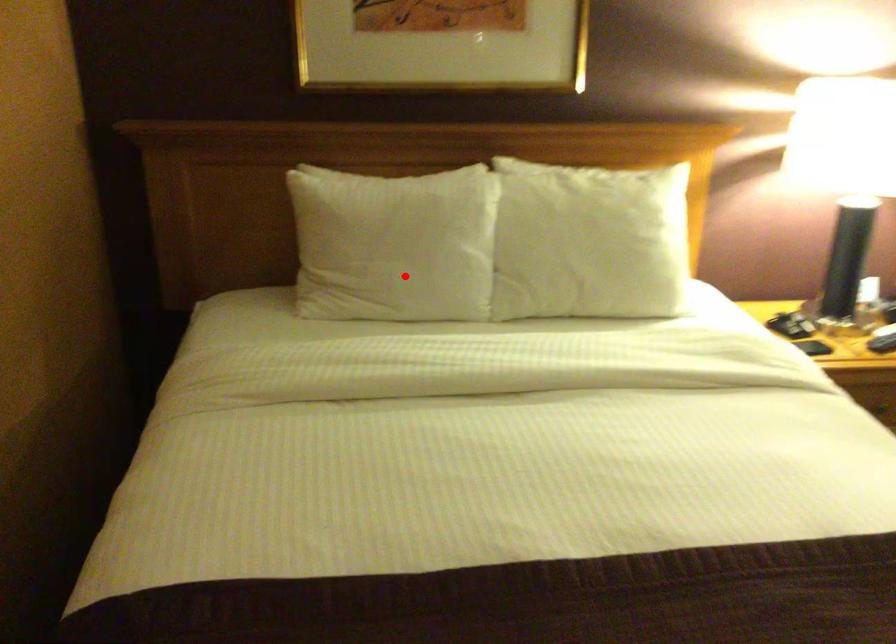
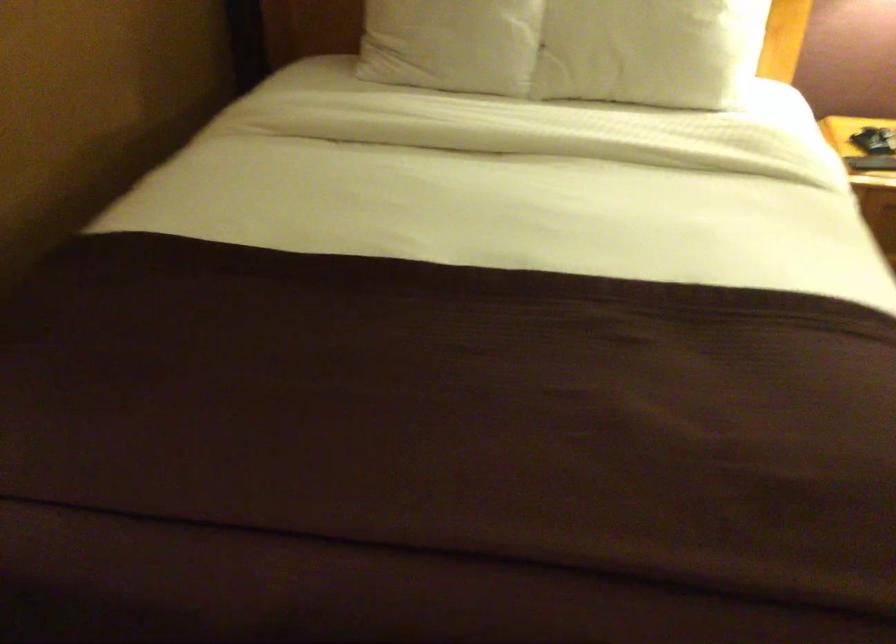
In the second image, find the point that corresponds to the highlighted location in the first image.

(452, 44)